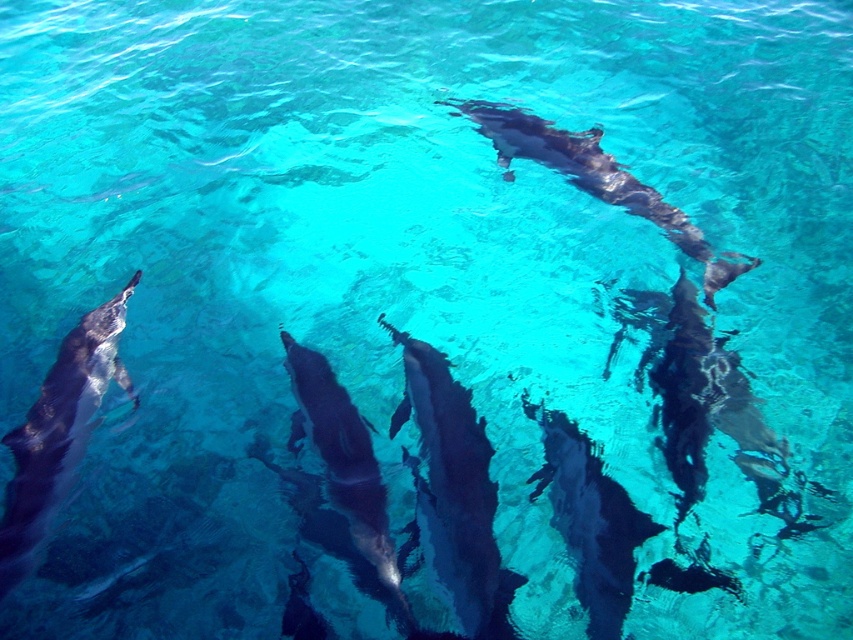
You are a marine biologist observing dolphins from a boat. You notice two dolphins in the water below you. One is the glossy dark gray dolphin at center and the other is the shiny dark gray dolphin at lower left. Which dolphin is closer to the surface of the water?

The shiny dark gray dolphin at lower left is closer to the surface of the water because the glossy dark gray dolphin at center is positioned under it.

You are a marine biologist observing the dolphins from above. You notice two shiny dark gray dolphin at lower left and shiny dark gray dolphin at center. Which dolphin is closer to the surface of the water?

The shiny dark gray dolphin at lower left is closer to the surface of the water because the shiny dark gray dolphin at center is behind it, meaning it is further away from the observer.